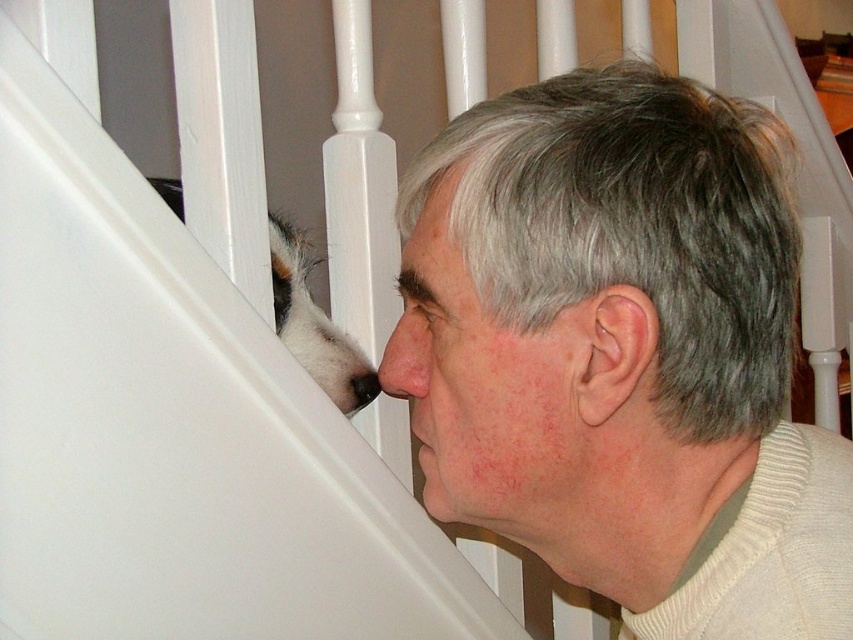
Who is higher up, white matte hair at upper center or matte white nose at center?

Positioned higher is matte white nose at center.

Does white matte hair at upper center have a lesser height compared to matte white nose at center?

No.

Is point (582, 529) more distant than point (386, 392)?

No.

The width and height of the screenshot is (853, 640). What are the coordinates of `white matte hair at upper center` in the screenshot? It's located at (628, 353).

Does white fur at lower left have a smaller size compared to matte white nose at center?

Incorrect, white fur at lower left is not smaller in size than matte white nose at center.

Based on the photo, between white fur at lower left and matte white nose at center, which one has more height?

With more height is white fur at lower left.

This screenshot has width=853, height=640. I want to click on white fur at lower left, so click(314, 324).

Identify the location of white fur at lower left. The width and height of the screenshot is (853, 640). (314, 324).

Which of these two, white matte hair at upper center or white ribbed sweater at lower right, stands taller?

white matte hair at upper center is taller.

Is white matte hair at upper center to the right of white ribbed sweater at lower right from the viewer's perspective?

Indeed, white matte hair at upper center is positioned on the right side of white ribbed sweater at lower right.

Between point (567, 536) and point (845, 522), which one is positioned behind?

Point (567, 536)

Where is `white matte hair at upper center`? This screenshot has height=640, width=853. white matte hair at upper center is located at coordinates (628, 353).